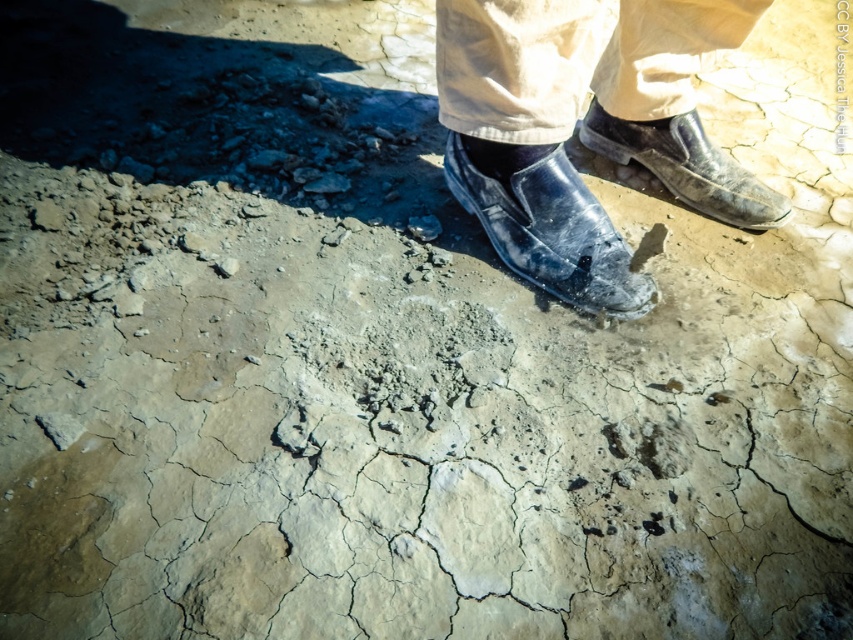
You are a photographer trying to capture the texture of the dry ground. You notice two points marked on your camera screen at coordinates point (596, 148) and point (697, 205). Which point should you focus on to get a clearer texture detail of the ground?

Point (596, 148) is further to the camera than point (697, 205). Therefore, focusing on point (697, 205) would allow you to capture clearer texture details since it is closer to the camera and less obscured by depth.

You are a hiker who needs to place a 12 inch long hiking stick between the shiny black shoes at center and the leather shoes at center. Can the hiking stick fit in the space between them?

The distance between the shiny black shoes at center and the leather shoes at center is 18.68 inches, which is wider than the 12 inch long hiking stick. Therefore, the hiking stick can fit between them.